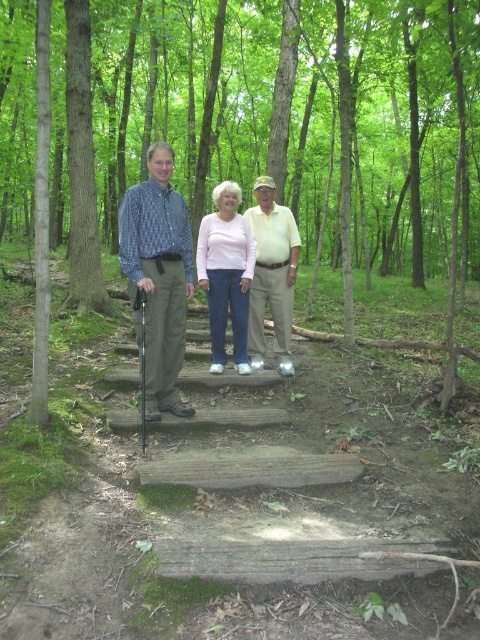
Question: Which point appears farthest from the camera in this image?

Choices:
 (A) (462, 140)
 (B) (243, 212)
 (C) (225, 352)

Answer: (B)

Question: Can you confirm if pink matte shirt at center is positioned to the right of weathered wooden bench at center?

Choices:
 (A) yes
 (B) no

Answer: (B)

Question: Observing the image, what is the correct spatial positioning of matte blue shirt at center in reference to blue plaid shirt at center?

Choices:
 (A) above
 (B) below

Answer: (A)

Question: Does blue plaid shirt at center appear over weathered wooden bench at center?

Choices:
 (A) no
 (B) yes

Answer: (B)

Question: Estimate the real-world distances between objects in this image. Which object is closer to the khaki cotton pants at center?

Choices:
 (A) pink matte shirt at center
 (B) blue plaid shirt at center

Answer: (A)

Question: Which object appears farthest from the camera in this image?

Choices:
 (A) pink matte shirt at center
 (B) weathered wooden bench at center
 (C) khaki cotton pants at center
 (D) green leafy trees at center

Answer: (C)